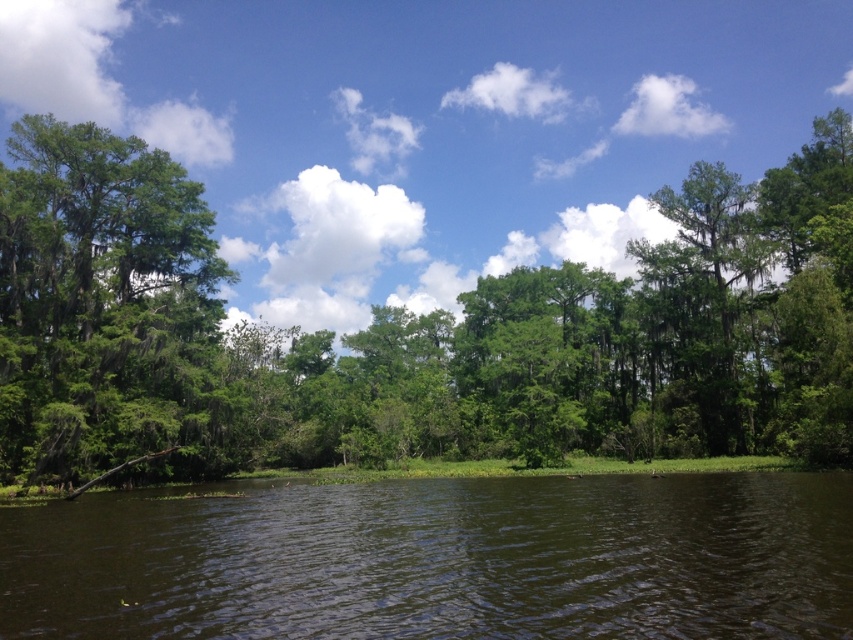
You are standing at the edge of the water and want to walk towards the green mossy tree at left. Which direction should you go to avoid stepping on the green grass at lower center?

To avoid stepping on the green grass at lower center, you should walk towards the green mossy tree at left while staying to the left side since the green grass at lower center is wider than the green mossy tree at left.

Based on the photo, you are a photographer positioned at the edge of the water in the scene. You want to capture both the point at coordinates point (605,422) and point (688,554) in your shot. Which point will appear closer to the camera in your photo?

Point (605,422) is further to the viewer than point (688,554), so in the photo, point (605,422) will appear closer to the camera than point (688,554).